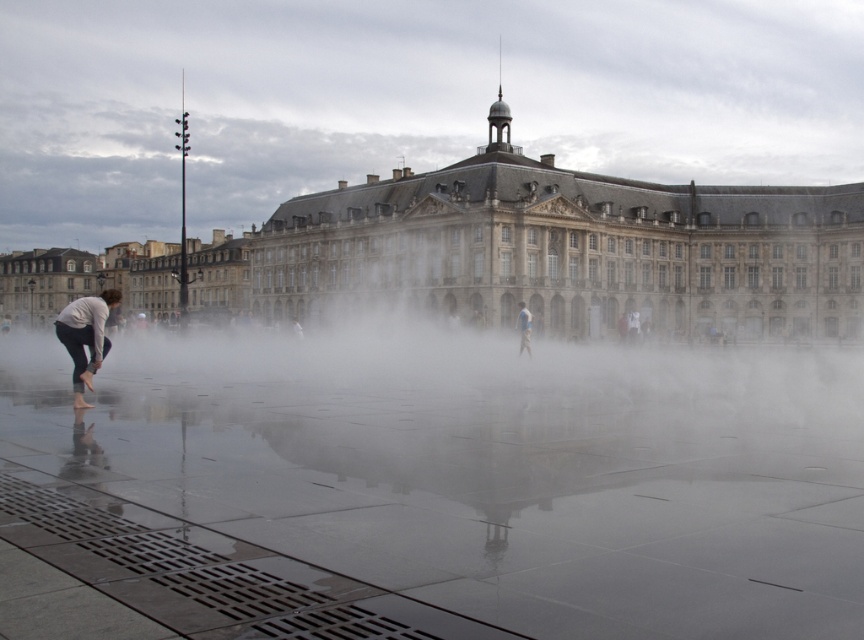
You are standing in the public square and want to take a photo of the stone building at center. Where should you position yourself to ensure the building is centered in your camera frame?

You should position yourself directly in front of the stone building at center, which is located at the coordinates point (528,250), to ensure it is centered in your camera frame.

You are standing in the public square and want to take a photo of the stone building at center. To ensure the building is fully visible in your photo, where should you position yourself relative to the fountain?

The stone building at center is located at point (528, 250), so you should position yourself at a vantage point that allows the camera to capture the building without obstruction from the fountain. Since the fountain is in the foreground, moving slightly to the side or further back might provide a clearer view of the building.